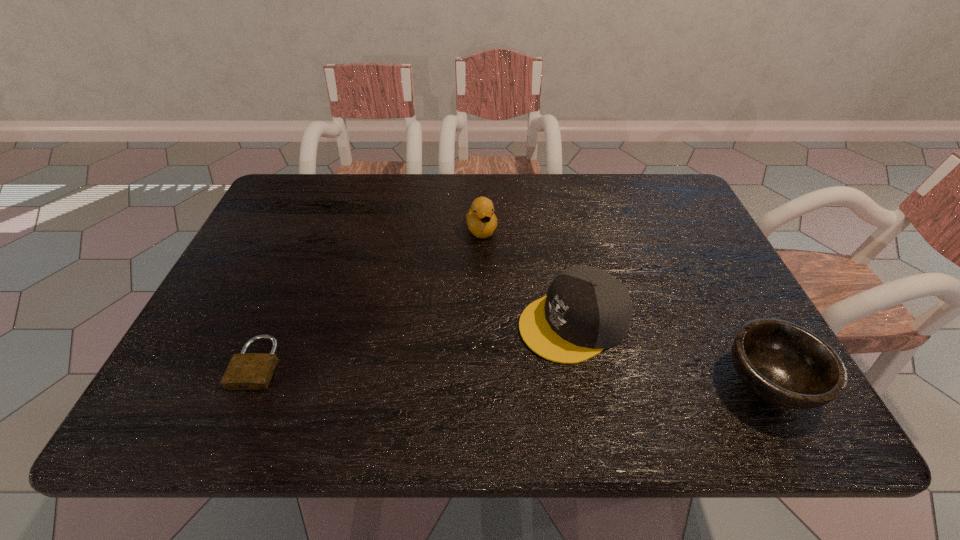
I want to click on empty location between the third object from right to left and the third object from left to right, so click(x=528, y=276).

Find the location of a particular element. The image size is (960, 540). unoccupied position between the leftmost object and the third object from left to right is located at coordinates (416, 343).

Where is `vacant area that lies between the shortest object and the rightmost object`? The height and width of the screenshot is (540, 960). vacant area that lies between the shortest object and the rightmost object is located at coordinates tap(514, 373).

Identify the location of free space between the second object from right to left and the second object from left to right. (528, 276).

Where is `free spot between the duckling and the shortest object`? The image size is (960, 540). free spot between the duckling and the shortest object is located at coordinates (370, 296).

I want to click on vacant area that lies between the rightmost object and the third object from left to right, so click(x=671, y=352).

Find the location of `free point between the shortest object and the cap`. free point between the shortest object and the cap is located at coordinates (416, 343).

The width and height of the screenshot is (960, 540). What are the coordinates of `free space between the padlock and the third tallest object` in the screenshot? It's located at (514, 373).

Identify which object is the second nearest to the padlock. Please provide its 2D coordinates. Your answer should be formatted as a tuple, i.e. [(x, y)], where the tuple contains the x and y coordinates of a point satisfying the conditions above.

[(586, 310)]

The image size is (960, 540). Find the location of `object that is the closest to the duckling`. object that is the closest to the duckling is located at coordinates (586, 310).